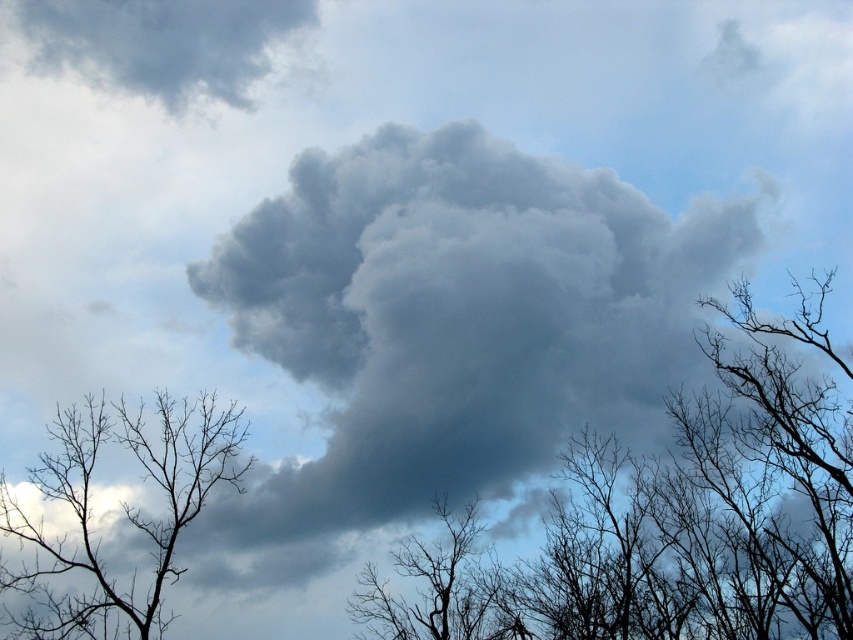
Question: Is silhouette bare branches at center below silhouette bare tree at center?

Choices:
 (A) no
 (B) yes

Answer: (A)

Question: Observing the image, what is the correct spatial positioning of gray fluffy cloud at upper left in reference to silhouette bare tree at center?

Choices:
 (A) left
 (B) right

Answer: (A)

Question: Which object is the farthest from the silhouette bare branches at left?

Choices:
 (A) silhouette bare tree at center
 (B) silhouette bare branches at center
 (C) gray fluffy cloud at upper left

Answer: (B)

Question: Is silhouette bare branches at center further to the viewer compared to gray fluffy cloud at upper left?

Choices:
 (A) yes
 (B) no

Answer: (B)

Question: Estimate the real-world distances between objects in this image. Which object is farther from the silhouette bare branches at center?

Choices:
 (A) silhouette bare tree at center
 (B) gray fluffy cloud at upper left

Answer: (B)

Question: Estimate the real-world distances between objects in this image. Which object is closer to the silhouette bare tree at center?

Choices:
 (A) silhouette bare branches at center
 (B) gray fluffy cloud at upper left
 (C) silhouette bare branches at left

Answer: (A)